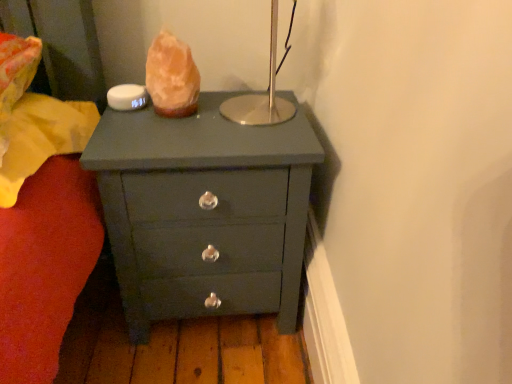
Question: Is the position of matte dark green chest of drawers at center less distant than that of orange crystal at center?

Choices:
 (A) no
 (B) yes

Answer: (B)

Question: Considering the relative positions of matte dark green chest of drawers at center and orange crystal at center in the image provided, is matte dark green chest of drawers at center to the left of orange crystal at center from the viewer's perspective?

Choices:
 (A) yes
 (B) no

Answer: (B)

Question: Considering the relative positions of matte dark green chest of drawers at center and orange crystal at center in the image provided, is matte dark green chest of drawers at center to the right of orange crystal at center from the viewer's perspective?

Choices:
 (A) no
 (B) yes

Answer: (B)

Question: From a real-world perspective, is matte dark green chest of drawers at center over orange crystal at center?

Choices:
 (A) yes
 (B) no

Answer: (B)

Question: From the image's perspective, would you say matte dark green chest of drawers at center is shown under orange crystal at center?

Choices:
 (A) no
 (B) yes

Answer: (B)

Question: Does matte dark green chest of drawers at center have a lesser height compared to orange crystal at center?

Choices:
 (A) no
 (B) yes

Answer: (A)

Question: Does orange crystal at center have a lesser height compared to matte dark green chest of drawers at center?

Choices:
 (A) yes
 (B) no

Answer: (A)

Question: Can you confirm if orange crystal at center is bigger than matte dark green chest of drawers at center?

Choices:
 (A) yes
 (B) no

Answer: (B)

Question: Is orange crystal at center directly adjacent to matte dark green chest of drawers at center?

Choices:
 (A) yes
 (B) no

Answer: (B)

Question: Can you confirm if orange crystal at center is thinner than matte dark green chest of drawers at center?

Choices:
 (A) no
 (B) yes

Answer: (B)

Question: Is orange crystal at center aimed at matte dark green chest of drawers at center?

Choices:
 (A) yes
 (B) no

Answer: (B)

Question: From the image's perspective, is orange crystal at center on top of matte dark green chest of drawers at center?

Choices:
 (A) yes
 (B) no

Answer: (A)

Question: Is point (270, 261) closer or farther from the camera than point (164, 92)?

Choices:
 (A) farther
 (B) closer

Answer: (A)